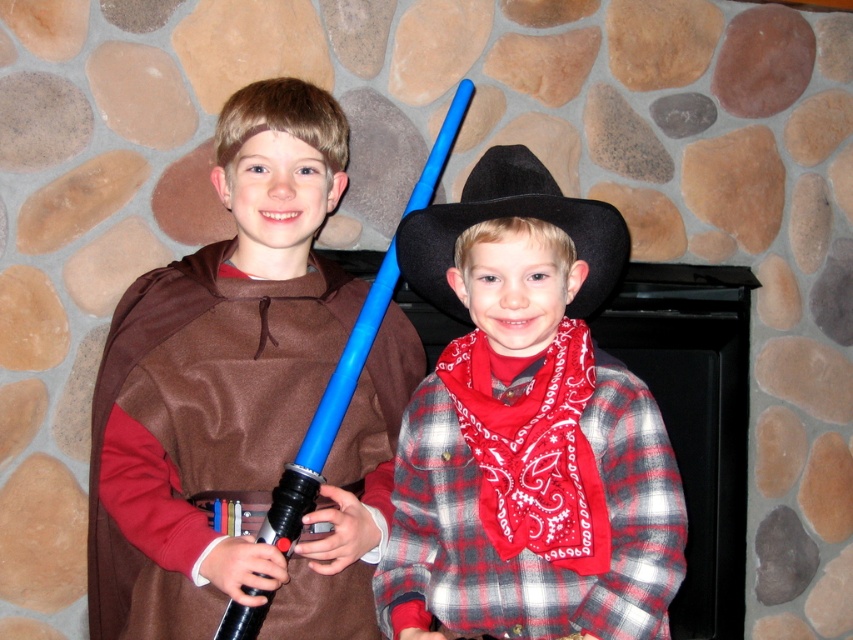
You are a costume designer preparing for a school play. You have two accessories to place on a display stand. The matte brown cape at left and the red bandana at center. Which accessory should you choose if you want to create a dramatic visual impact with a larger size?

The matte brown cape at left is larger in size than the red bandana at center, so you should choose the matte brown cape at left to create a dramatic visual impact with a larger size.